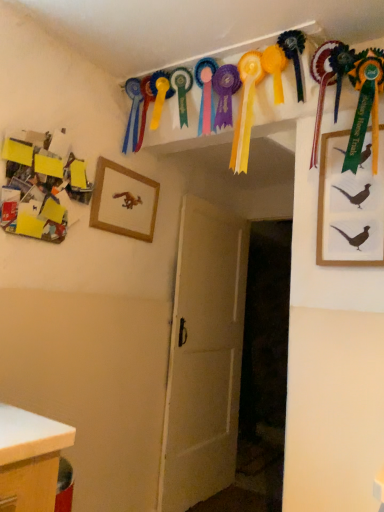
Question: Does white wooden door at center have a greater width compared to wooden picture frame at center-left, which is the 2th picture frame in front-to-back order?

Choices:
 (A) yes
 (B) no

Answer: (A)

Question: From the image's perspective, is white wooden door at center under wooden picture frame at center-left, arranged as the second picture frame when viewed from the right?

Choices:
 (A) yes
 (B) no

Answer: (A)

Question: From a real-world perspective, is white wooden door at center under wooden picture frame at center-left, arranged as the second picture frame when viewed from the right?

Choices:
 (A) no
 (B) yes

Answer: (B)

Question: From the image's perspective, would you say white wooden door at center is positioned over wooden picture frame at center-left, arranged as the 1th picture frame when viewed from the left?

Choices:
 (A) yes
 (B) no

Answer: (B)

Question: Is the depth of white wooden door at center greater than that of wooden picture frame at center-left, arranged as the second picture frame when viewed from the right?

Choices:
 (A) yes
 (B) no

Answer: (A)

Question: From their relative heights in the image, would you say white wooden door at center is taller or shorter than wooden picture frame at center-left, which is the 2th picture frame in front-to-back order?

Choices:
 (A) short
 (B) tall

Answer: (B)

Question: From a real-world perspective, relative to wooden picture frame at center-left, arranged as the second picture frame when viewed from the right, is white wooden door at center vertically above or below?

Choices:
 (A) above
 (B) below

Answer: (B)

Question: Looking at their shapes, would you say white wooden door at center is wider or thinner than wooden picture frame at center-left, which is the 1th picture frame from back to front?

Choices:
 (A) wide
 (B) thin

Answer: (A)

Question: Considering the positions of point (228, 428) and point (127, 232), is point (228, 428) closer or farther from the camera than point (127, 232)?

Choices:
 (A) farther
 (B) closer

Answer: (A)

Question: From their relative heights in the image, would you say white matte desk at lower left is taller or shorter than white wooden door at center?

Choices:
 (A) tall
 (B) short

Answer: (B)

Question: Based on their positions, is white matte desk at lower left located to the left or right of white wooden door at center?

Choices:
 (A) left
 (B) right

Answer: (A)

Question: Looking at their shapes, would you say white matte desk at lower left is wider or thinner than white wooden door at center?

Choices:
 (A) wide
 (B) thin

Answer: (A)

Question: From a real-world perspective, is white matte desk at lower left above or below white wooden door at center?

Choices:
 (A) above
 (B) below

Answer: (B)

Question: Does point (1, 428) appear closer or farther from the camera than point (97, 215)?

Choices:
 (A) closer
 (B) farther

Answer: (A)

Question: Which is correct: white matte desk at lower left is inside wooden picture frame at center-left, arranged as the second picture frame when viewed from the right, or outside of it?

Choices:
 (A) inside
 (B) outside

Answer: (B)